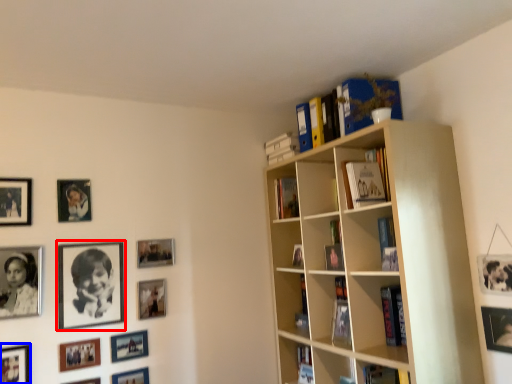
Question: Which point is closer to the camera, picture frame (highlighted by a red box) or picture frame (highlighted by a blue box)?

Choices:
 (A) picture frame
 (B) picture frame

Answer: (B)